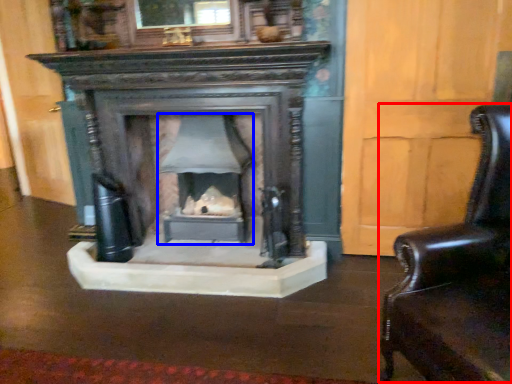
Question: Which point is closer to the camera, swivel chair (highlighted by a red box) or fireplace (highlighted by a blue box)?

Choices:
 (A) swivel chair
 (B) fireplace

Answer: (A)